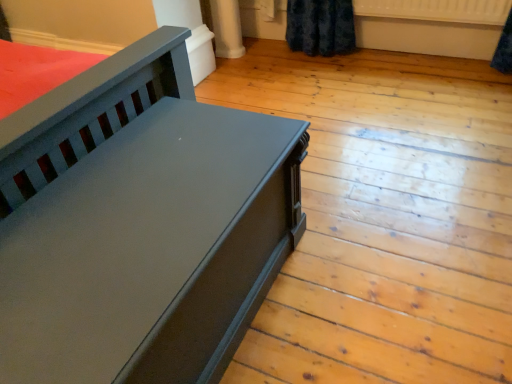
This screenshot has height=384, width=512. I want to click on vacant area on top of matte black bench at left (from a real-world perspective), so point(120,230).